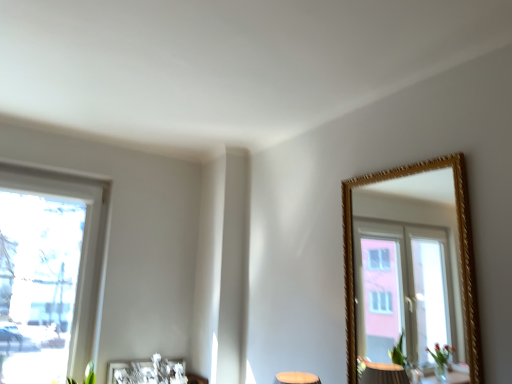
Question: Is metallic silver picture frame at lower center bigger or smaller than white plastic window at left?

Choices:
 (A) small
 (B) big

Answer: (A)

Question: In terms of height, does metallic silver picture frame at lower center look taller or shorter compared to white plastic window at left?

Choices:
 (A) short
 (B) tall

Answer: (A)

Question: Would you say metallic silver picture frame at lower center is to the left or to the right of white plastic window at left in the picture?

Choices:
 (A) left
 (B) right

Answer: (B)

Question: Is white plastic window at left taller or shorter than metallic silver picture frame at lower center?

Choices:
 (A) tall
 (B) short

Answer: (A)

Question: Choose the correct answer: Is white plastic window at left inside metallic silver picture frame at lower center or outside it?

Choices:
 (A) outside
 (B) inside

Answer: (A)

Question: Looking at their shapes, would you say white plastic window at left is wider or thinner than metallic silver picture frame at lower center?

Choices:
 (A) thin
 (B) wide

Answer: (B)

Question: In the image, is white plastic window at left on the left side or the right side of metallic silver picture frame at lower center?

Choices:
 (A) left
 (B) right

Answer: (A)